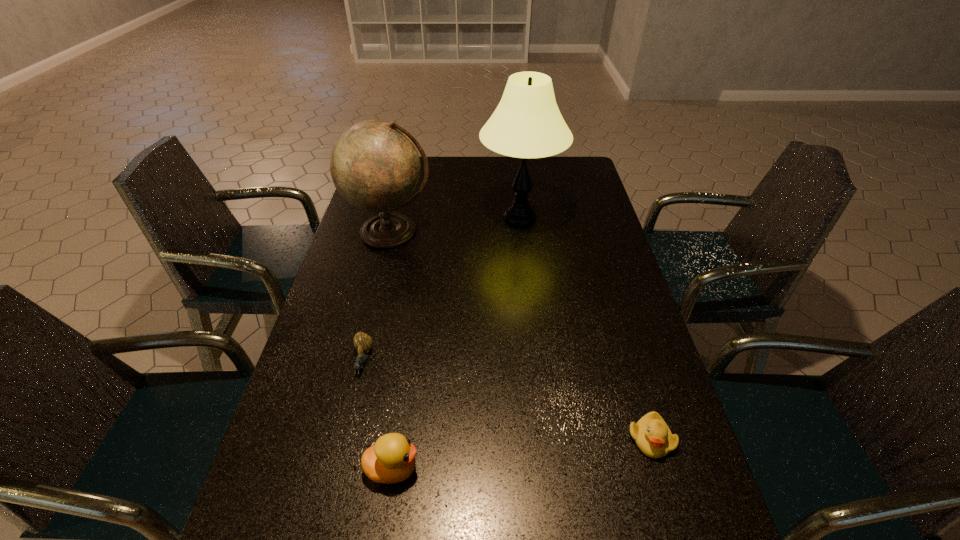
Where is `vacant space that's between the right duckling and the fourth shortest object`? Image resolution: width=960 pixels, height=540 pixels. vacant space that's between the right duckling and the fourth shortest object is located at coordinates (521, 335).

Where is `free space between the tallest object and the taller duckling`? free space between the tallest object and the taller duckling is located at coordinates pyautogui.click(x=456, y=343).

At what (x,y) coordinates should I click in order to perform the action: click on vacant point located between the left duckling and the globe. Please return your answer as a coordinate pair (x, y). The height and width of the screenshot is (540, 960). Looking at the image, I should click on (392, 350).

Identify the location of unoccupied position between the globe and the left duckling. (392, 350).

Find the location of a particular element. The width and height of the screenshot is (960, 540). vacant space in between the fourth object from left to right and the third nearest object is located at coordinates pyautogui.click(x=442, y=289).

You are a GUI agent. You are given a task and a screenshot of the screen. Output one action in this format:
    pyautogui.click(x=<x>, y=<y>)
    Task: Click on the vacant area between the third farthest object and the taller duckling
    This screenshot has width=960, height=540.
    Given the screenshot: What is the action you would take?
    pyautogui.click(x=378, y=414)

The height and width of the screenshot is (540, 960). Identify the location of vacant area that lies between the third shortest object and the rightmost object. (521, 454).

Where is `free space between the shorter duckling and the tallest object`? The width and height of the screenshot is (960, 540). free space between the shorter duckling and the tallest object is located at coordinates (586, 328).

The image size is (960, 540). Find the location of `vacant space that is in between the third shortest object and the third farthest object`. vacant space that is in between the third shortest object and the third farthest object is located at coordinates (378, 414).

Where is `free space between the rightmost object and the escargot`? free space between the rightmost object and the escargot is located at coordinates (507, 400).